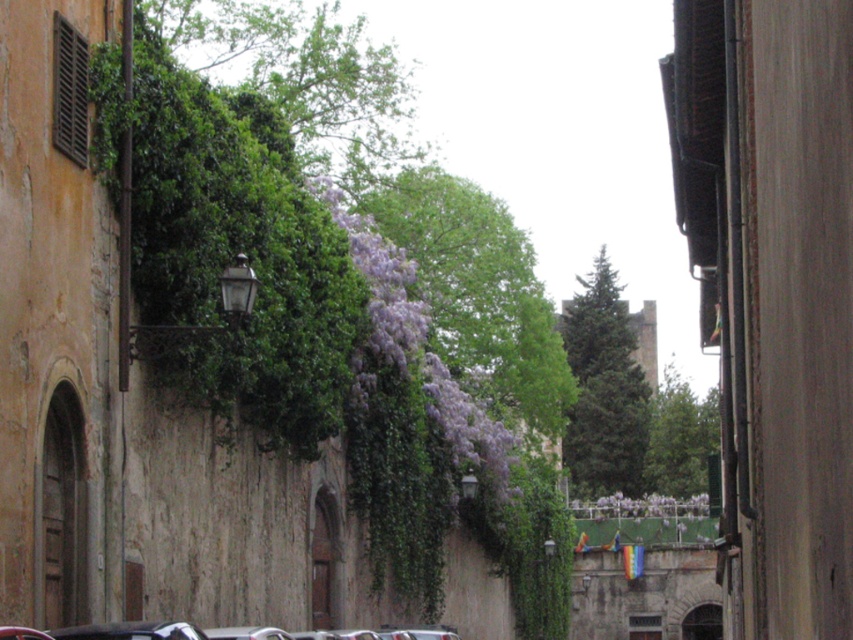
Can you confirm if green matte tree at center is shorter than green leafy tree at center?

Incorrect, green matte tree at center's height does not fall short of green leafy tree at center's.

Describe the element at coordinates (604, 388) in the screenshot. The image size is (853, 640). I see `green matte tree at center` at that location.

Locate an element on the screen. green matte tree at center is located at coordinates (604, 388).

Locate an element on the screen. The height and width of the screenshot is (640, 853). green matte tree at center is located at coordinates (604, 388).

Who is taller, purple leafy tree at center or green leafy tree at center?

purple leafy tree at center is taller.

The width and height of the screenshot is (853, 640). What do you see at coordinates (479, 292) in the screenshot?
I see `purple leafy tree at center` at bounding box center [479, 292].

Does point (521, 260) come in front of point (679, 486)?

Yes, point (521, 260) is closer to viewer.

Identify the location of purple leafy tree at center. (479, 292).

Who is higher up, green leafy tree at upper left or green leafy tree at center?

Result: green leafy tree at upper left

Between point (374, 131) and point (686, 419), which one is positioned in front?

Positioned in front is point (686, 419).

The height and width of the screenshot is (640, 853). In order to click on green leafy tree at upper left in this screenshot , I will do `click(305, 77)`.

Find the location of `green leafy tree at upper left`. green leafy tree at upper left is located at coordinates (305, 77).